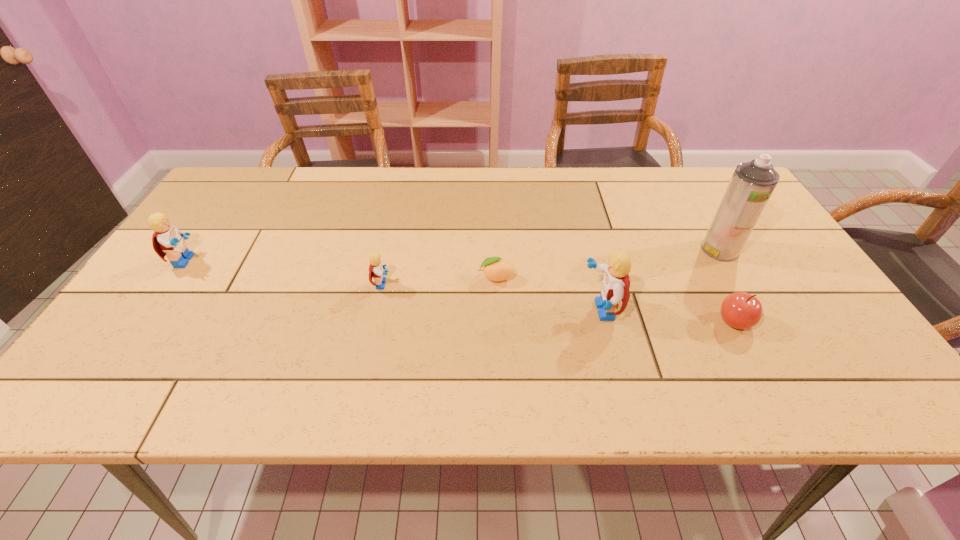
This screenshot has width=960, height=540. Identify the location of the leftmost Lego. (167, 240).

Locate an element on the screen. The height and width of the screenshot is (540, 960). the leftmost object is located at coordinates (167, 240).

Identify the location of the second Lego from right to left. This screenshot has height=540, width=960. (376, 268).

At what (x,y) coordinates should I click in order to perform the action: click on the shortest Lego. Please return your answer as a coordinate pair (x, y). Looking at the image, I should click on (376, 268).

The width and height of the screenshot is (960, 540). In order to click on the fourth object from left to right in this screenshot , I will do `click(615, 283)`.

I want to click on the rightmost Lego, so click(615, 283).

You are a GUI agent. You are given a task and a screenshot of the screen. Output one action in this format:
    pyautogui.click(x=<x>, y=<y>)
    Task: Click on the aerosol can
    The width and height of the screenshot is (960, 540).
    Given the screenshot: What is the action you would take?
    pyautogui.click(x=752, y=183)

You are a GUI agent. You are given a task and a screenshot of the screen. Output one action in this format:
    pyautogui.click(x=<x>, y=<y>)
    Task: Click on the fourth object from right to left
    The width and height of the screenshot is (960, 540).
    Given the screenshot: What is the action you would take?
    tap(494, 269)

At what (x,y) coordinates should I click in order to perform the action: click on lemon. Please return your answer as a coordinate pair (x, y). This screenshot has height=540, width=960. Looking at the image, I should click on (494, 269).

Locate an element on the screen. The image size is (960, 540). apple is located at coordinates (740, 310).